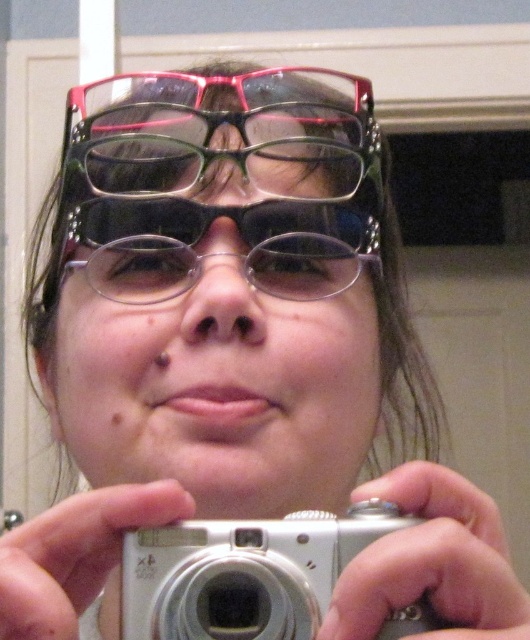
You are a photographer trying to capture a unique selfie with all the glasses in focus. The transparent plastic glasses at center are 14.48 inches apart. What is the minimum distance you should set your camera lens to ensure all glasses are in focus?

To ensure all transparent plastic glasses at center are in focus, the camera lens should be set to a distance of at least 14.48 inches, as this is the distance between the closest and farthest glasses.

You are a photographer trying to capture a detailed shot of the silver metallic camera at center. However, there are transparent plastic glasses at center in the way. Can you adjust your angle to focus on the camera without the glasses obstructing the view?

The transparent plastic glasses at center are closer to you than the silver metallic camera at center, so you can tilt your camera upwards or downwards to position the glasses either above or below the camera in the frame, allowing an unobstructed view of the silver metallic camera at center.

From the picture: You are a photographer trying to capture a close up of the transparent plastic glasses at center. Where should you position your camera to ensure the glasses are in the center of the frame?

The transparent plastic glasses at center are located at point (216, 173), so position your camera directly facing that coordinate to center them in the frame.